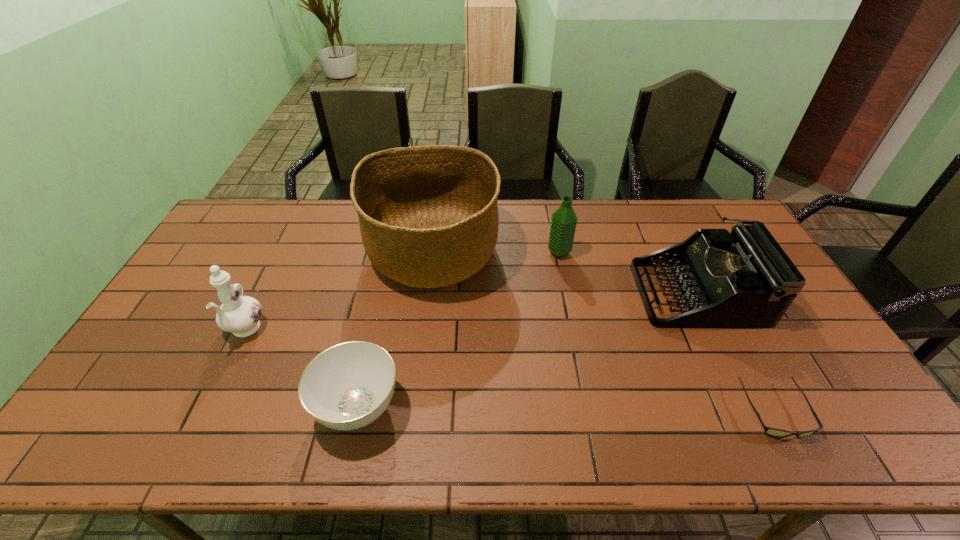
This screenshot has width=960, height=540. What are the coordinates of `object at the near right corner` in the screenshot? It's located at click(774, 432).

In the image, there is a desktop. At what (x,y) coordinates should I click in order to perform the action: click on vacant space at the far edge. Please return your answer as a coordinate pair (x, y). This screenshot has height=540, width=960. Looking at the image, I should click on (654, 234).

This screenshot has height=540, width=960. I want to click on free region at the left edge of the desktop, so click(189, 284).

The image size is (960, 540). Identify the location of vacant position at the right edge of the desktop. (822, 403).

Identify the location of vacant space at the near right corner of the desktop. This screenshot has width=960, height=540. (869, 438).

Image resolution: width=960 pixels, height=540 pixels. I want to click on free space between the right chinaware and the farther chinaware, so click(301, 369).

You are a GUI agent. You are given a task and a screenshot of the screen. Output one action in this format:
    pyautogui.click(x=<x>, y=<y>)
    Task: Click on the free space between the tallest object and the water bottle
    The height and width of the screenshot is (540, 960).
    Given the screenshot: What is the action you would take?
    pyautogui.click(x=496, y=254)

Locate an element on the screen. This screenshot has height=540, width=960. vacant space that's between the third object from right to left and the typewriter is located at coordinates (628, 273).

Locate an element on the screen. This screenshot has width=960, height=540. free point between the basket and the leftmost object is located at coordinates (339, 293).

Where is `vacant area between the basket and the third shortest object`? vacant area between the basket and the third shortest object is located at coordinates (564, 273).